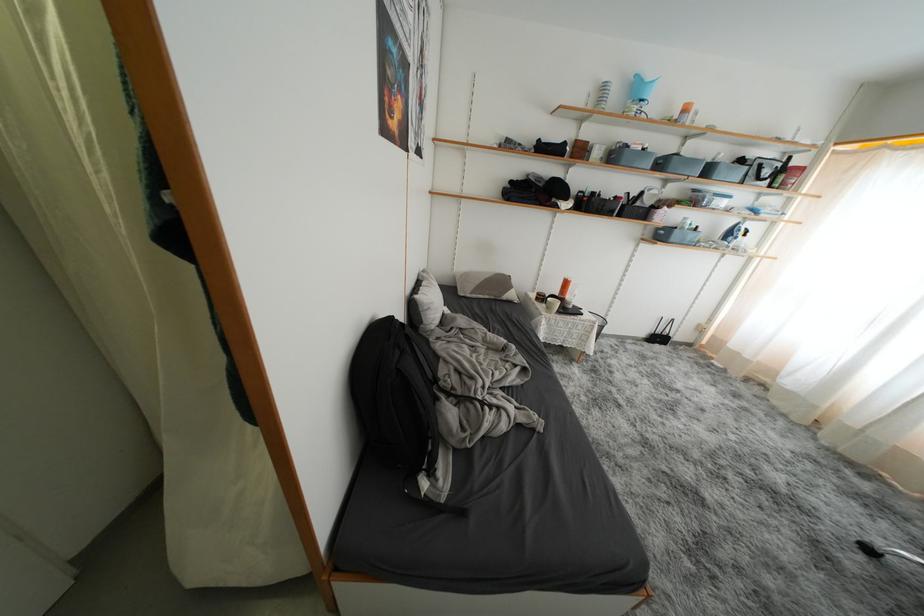
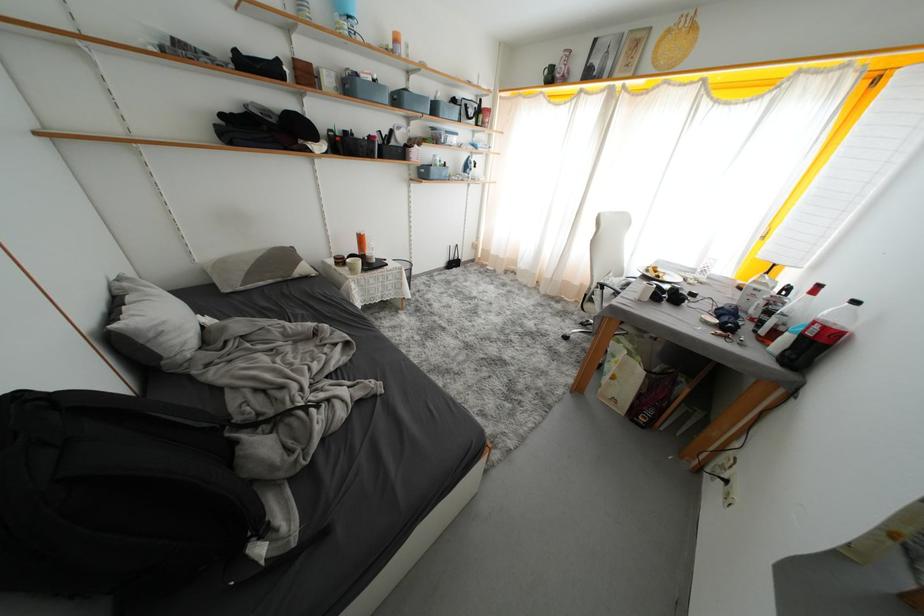
Find the pixel in the second image that matches (669,238) in the first image.

(431, 177)